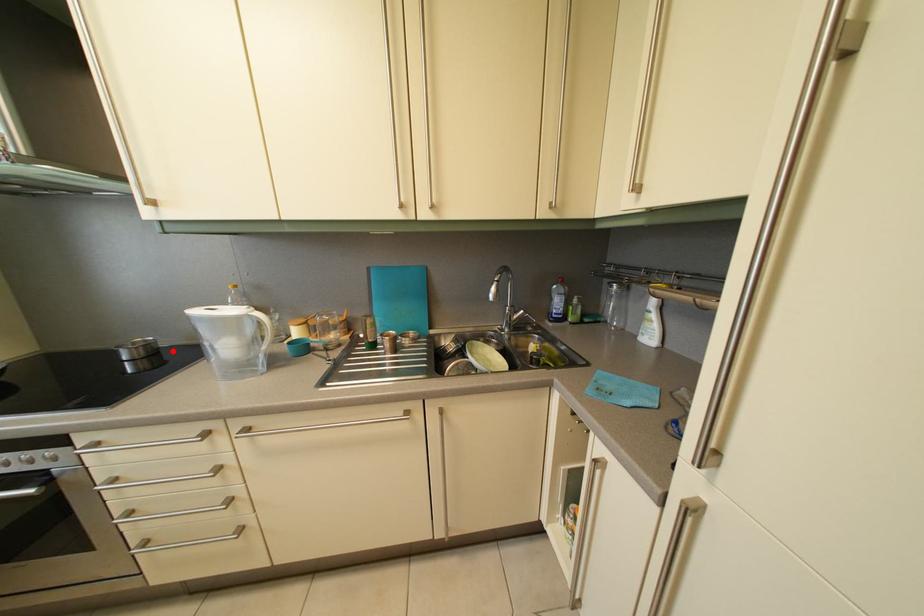
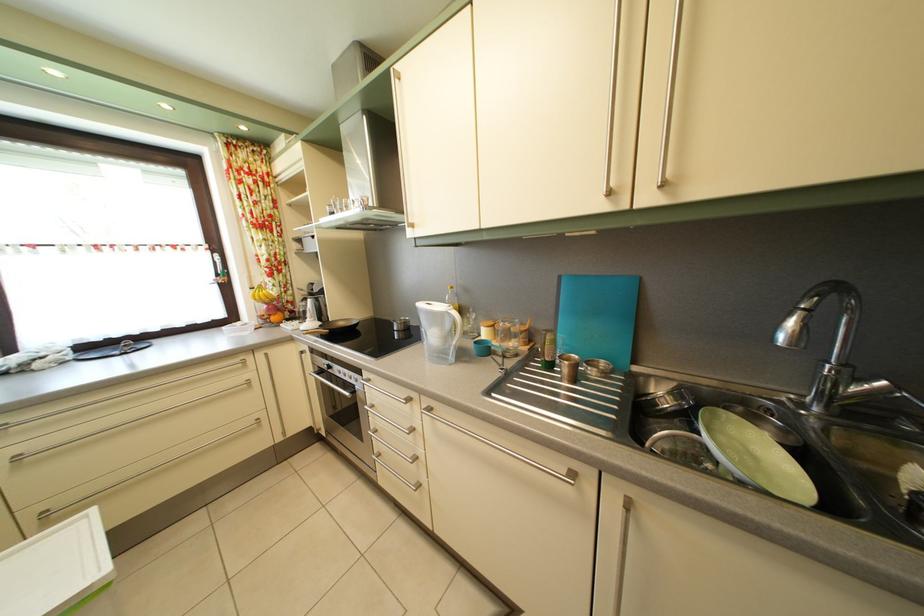
In the second image, find the point that corresponds to the highlighted location in the first image.

(420, 331)